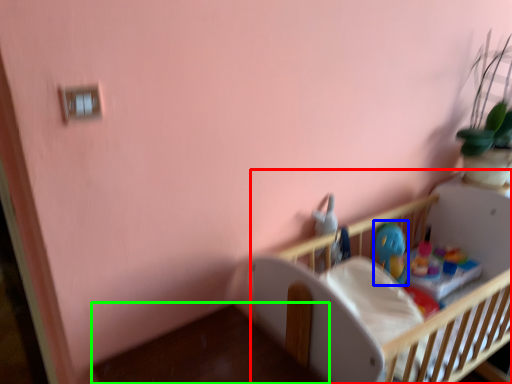
Question: Based on their relative distances, which object is nearer to infant bed (highlighted by a red box)? Choose from toy (highlighted by a blue box) and table (highlighted by a green box).

Choices:
 (A) toy
 (B) table

Answer: (A)